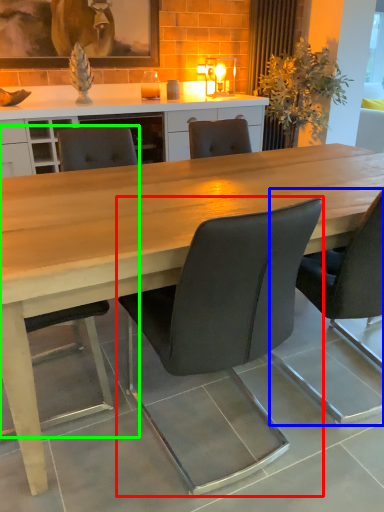
Question: Estimate the real-world distances between objects in this image. Which object is closer to chair (highlighted by a red box), chair (highlighted by a blue box) or chair (highlighted by a green box)?

Choices:
 (A) chair
 (B) chair

Answer: (A)